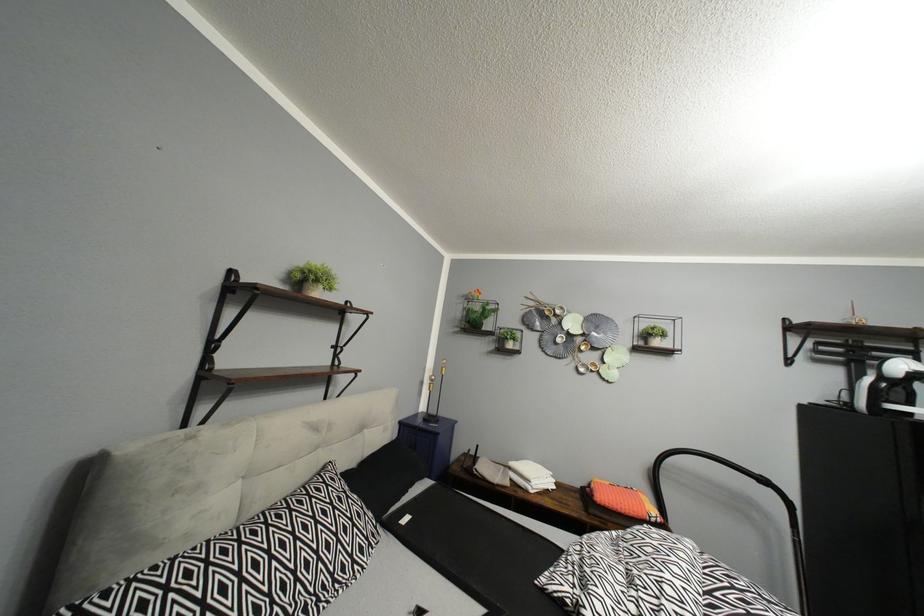
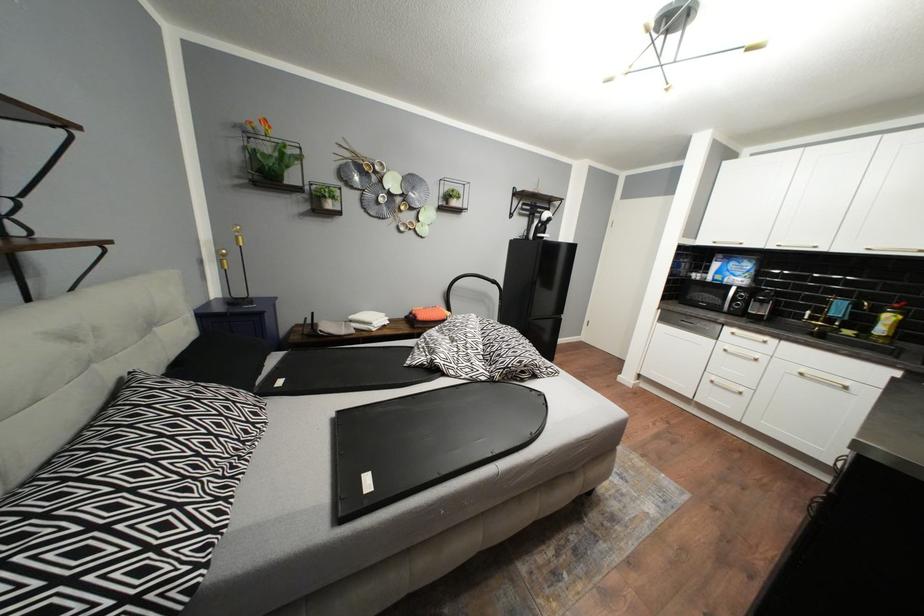
How did the camera likely rotate?

The camera's rotation is toward right-down.